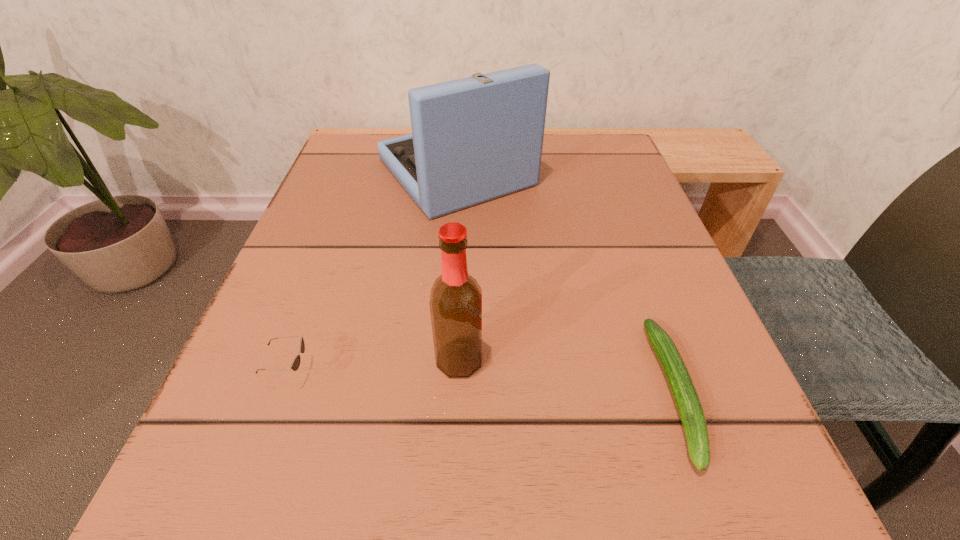
The height and width of the screenshot is (540, 960). In order to click on the farthest object in this screenshot , I will do `click(475, 139)`.

At what (x,y) coordinates should I click in order to perform the action: click on beer bottle. Please return your answer as a coordinate pair (x, y). Looking at the image, I should click on (455, 304).

This screenshot has width=960, height=540. Identify the location of sunglasses. (295, 365).

You are a GUI agent. You are given a task and a screenshot of the screen. Output one action in this format:
    pyautogui.click(x=<x>, y=<y>)
    Task: Click on the rightmost object
    
    Given the screenshot: What is the action you would take?
    pyautogui.click(x=688, y=404)

The height and width of the screenshot is (540, 960). Find the location of `zucchini`. zucchini is located at coordinates (688, 404).

This screenshot has height=540, width=960. Identify the location of free space located on the front of the farthest object. (446, 299).

Locate an element on the screen. The image size is (960, 540). vacant space located 0.250m on the back of the beer bottle is located at coordinates (465, 228).

You are a GUI agent. You are given a task and a screenshot of the screen. Output one action in this format:
    pyautogui.click(x=<x>, y=<y>)
    Task: Click on the free region located in front of the lenses of the third tallest object
    Image resolution: width=960 pixels, height=540 pixels.
    Given the screenshot: What is the action you would take?
    pyautogui.click(x=350, y=373)

In order to click on object that is at the far edge in this screenshot , I will do `click(475, 139)`.

You are a GUI agent. You are given a task and a screenshot of the screen. Output one action in this format:
    pyautogui.click(x=<x>, y=<y>)
    Task: Click on the object at the near edge
    Image resolution: width=960 pixels, height=540 pixels.
    Given the screenshot: What is the action you would take?
    pyautogui.click(x=688, y=404)